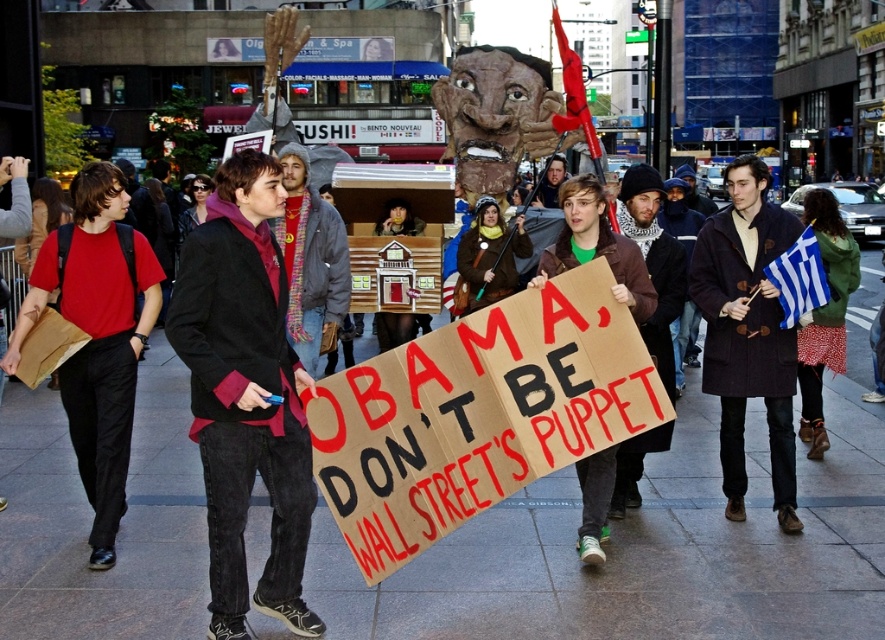
You are a photographer at the protest scene described. You need to capture a photo focusing on the two individuals wearing dark brown wool coat at center and dark brown leather jacket at center. Which one is positioned lower in the frame?

The dark brown wool coat at center is located below the dark brown leather jacket at center, so the dark brown wool coat at center is positioned lower in the frame.

Based on the photo, you are a photographer trying to capture a photo of the protest scene. You want to ensure both the dark brown wool coat at center and the dark brown leather jacket at center are clearly visible in the frame. Given their sizes, which one might block the view of the other?

The dark brown wool coat at center is taller than the dark brown leather jacket at center, so it might block the view of the jacket if positioned in front.